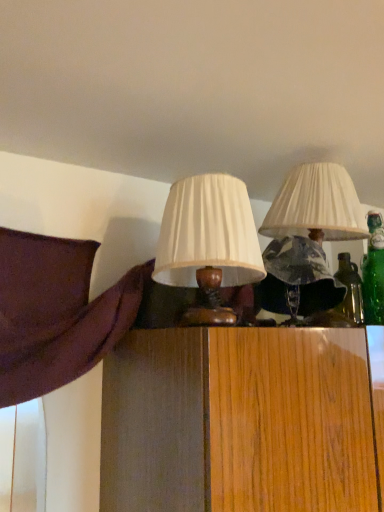
Find the location of a particular element. This screenshot has height=512, width=384. matte white lampshade at center, the second lamp positioned from the left is located at coordinates (308, 239).

Describe the element at coordinates (308, 239) in the screenshot. I see `matte white lampshade at center, which ranks as the 1th lamp in right-to-left order` at that location.

How much space does matte white lampshade at center, which ranks as the 1th lamp in right-to-left order, occupy vertically?

17.88 inches.

What is the approximate width of matte white lampshade at center, which ranks as the 1th lamp in right-to-left order?

matte white lampshade at center, which ranks as the 1th lamp in right-to-left order, is 12.69 inches in width.

The height and width of the screenshot is (512, 384). I want to click on matte white lampshade at center, the second lamp in the right-to-left sequence, so click(x=208, y=244).

The image size is (384, 512). Describe the element at coordinates (208, 244) in the screenshot. I see `matte white lampshade at center, placed as the first lamp when sorted from left to right` at that location.

Locate an element on the screen. This screenshot has width=384, height=512. matte white lampshade at center, the second lamp positioned from the left is located at coordinates (308, 239).

Considering the relative positions of matte white lampshade at center, which ranks as the 1th lamp in right-to-left order, and matte white lampshade at center, the second lamp in the right-to-left sequence, in the image provided, is matte white lampshade at center, which ranks as the 1th lamp in right-to-left order, to the left of matte white lampshade at center, the second lamp in the right-to-left sequence, from the viewer's perspective?

No.

Which object is closer to the camera, matte white lampshade at center, the second lamp positioned from the left, or matte white lampshade at center, placed as the first lamp when sorted from left to right?

matte white lampshade at center, placed as the first lamp when sorted from left to right, is in front.

Does point (304, 205) lie in front of point (198, 181)?

No, it is behind (198, 181).

From the image's perspective, is matte white lampshade at center, the second lamp positioned from the left, on matte white lampshade at center, the second lamp in the right-to-left sequence?

Yes, from the image's perspective, matte white lampshade at center, the second lamp positioned from the left, is above matte white lampshade at center, the second lamp in the right-to-left sequence.

From a real-world perspective, which is physically below, matte white lampshade at center, the second lamp positioned from the left, or matte white lampshade at center, the second lamp in the right-to-left sequence?

From a 3D spatial view, matte white lampshade at center, the second lamp in the right-to-left sequence, is below.

Considering the sizes of objects matte white lampshade at center, the second lamp positioned from the left, and matte white lampshade at center, the second lamp in the right-to-left sequence, in the image provided, who is wider, matte white lampshade at center, the second lamp positioned from the left, or matte white lampshade at center, the second lamp in the right-to-left sequence,?

matte white lampshade at center, the second lamp positioned from the left.

From their relative heights in the image, would you say matte white lampshade at center, the second lamp positioned from the left, is taller or shorter than matte white lampshade at center, placed as the first lamp when sorted from left to right?

Clearly, matte white lampshade at center, the second lamp positioned from the left, is taller compared to matte white lampshade at center, placed as the first lamp when sorted from left to right.

Is matte white lampshade at center, which ranks as the 1th lamp in right-to-left order, smaller than matte white lampshade at center, the second lamp in the right-to-left sequence?

Incorrect, matte white lampshade at center, which ranks as the 1th lamp in right-to-left order, is not smaller in size than matte white lampshade at center, the second lamp in the right-to-left sequence.

In the scene shown: Is matte white lampshade at center, which ranks as the 1th lamp in right-to-left order, not within matte white lampshade at center, placed as the first lamp when sorted from left to right?

Yes, matte white lampshade at center, which ranks as the 1th lamp in right-to-left order, is not within matte white lampshade at center, placed as the first lamp when sorted from left to right.

Is matte white lampshade at center, which ranks as the 1th lamp in right-to-left order, next to matte white lampshade at center, the second lamp in the right-to-left sequence?

No, matte white lampshade at center, which ranks as the 1th lamp in right-to-left order, is not making contact with matte white lampshade at center, the second lamp in the right-to-left sequence.

Is matte white lampshade at center, the second lamp positioned from the left, facing away from matte white lampshade at center, placed as the first lamp when sorted from left to right?

No, matte white lampshade at center, the second lamp positioned from the left, is not facing away from matte white lampshade at center, placed as the first lamp when sorted from left to right.

Can you tell me how much matte white lampshade at center, the second lamp positioned from the left, and matte white lampshade at center, the second lamp in the right-to-left sequence, differ in facing direction?

There is a 0.000387-degree angle between the facing directions of matte white lampshade at center, the second lamp positioned from the left, and matte white lampshade at center, the second lamp in the right-to-left sequence.

Where is `lamp on the left of the matte white lampshade at center, which ranks as the 1th lamp in right-to-left order`? The width and height of the screenshot is (384, 512). lamp on the left of the matte white lampshade at center, which ranks as the 1th lamp in right-to-left order is located at coordinates (208, 244).

Considering the relative positions of matte white lampshade at center, the second lamp in the right-to-left sequence, and matte white lampshade at center, which ranks as the 1th lamp in right-to-left order, in the image provided, is matte white lampshade at center, the second lamp in the right-to-left sequence, to the right of matte white lampshade at center, which ranks as the 1th lamp in right-to-left order, from the viewer's perspective?

In fact, matte white lampshade at center, the second lamp in the right-to-left sequence, is to the left of matte white lampshade at center, which ranks as the 1th lamp in right-to-left order.

Is the position of matte white lampshade at center, placed as the first lamp when sorted from left to right, more distant than that of matte white lampshade at center, the second lamp positioned from the left?

No, matte white lampshade at center, placed as the first lamp when sorted from left to right, is closer to the camera.

Between point (247, 267) and point (309, 182), which one is positioned behind?

The point (309, 182) is farther from the camera.

From the image's perspective, which object appears higher, matte white lampshade at center, the second lamp in the right-to-left sequence, or matte white lampshade at center, which ranks as the 1th lamp in right-to-left order?

matte white lampshade at center, which ranks as the 1th lamp in right-to-left order, from the image's perspective.

From a real-world perspective, is matte white lampshade at center, the second lamp in the right-to-left sequence, below matte white lampshade at center, which ranks as the 1th lamp in right-to-left order?

Yes.

Which of these two, matte white lampshade at center, placed as the first lamp when sorted from left to right, or matte white lampshade at center, the second lamp positioned from the left, is thinner?

With smaller width is matte white lampshade at center, placed as the first lamp when sorted from left to right.

Between matte white lampshade at center, the second lamp in the right-to-left sequence, and matte white lampshade at center, which ranks as the 1th lamp in right-to-left order, which one has more height?

Standing taller between the two is matte white lampshade at center, which ranks as the 1th lamp in right-to-left order.

Who is smaller, matte white lampshade at center, placed as the first lamp when sorted from left to right, or matte white lampshade at center, which ranks as the 1th lamp in right-to-left order?

matte white lampshade at center, placed as the first lamp when sorted from left to right.

Would you say matte white lampshade at center, placed as the first lamp when sorted from left to right, is inside or outside matte white lampshade at center, which ranks as the 1th lamp in right-to-left order?

matte white lampshade at center, placed as the first lamp when sorted from left to right, is spatially situated outside matte white lampshade at center, which ranks as the 1th lamp in right-to-left order.

Is matte white lampshade at center, placed as the first lamp when sorted from left to right, next to matte white lampshade at center, which ranks as the 1th lamp in right-to-left order, and touching it?

No, matte white lampshade at center, placed as the first lamp when sorted from left to right, is not making contact with matte white lampshade at center, which ranks as the 1th lamp in right-to-left order.

Does matte white lampshade at center, the second lamp in the right-to-left sequence, turn towards matte white lampshade at center, the second lamp positioned from the left?

No, matte white lampshade at center, the second lamp in the right-to-left sequence, is not aimed at matte white lampshade at center, the second lamp positioned from the left.

Could you measure the distance between matte white lampshade at center, the second lamp in the right-to-left sequence, and matte white lampshade at center, the second lamp positioned from the left?

They are 8.56 inches apart.

The height and width of the screenshot is (512, 384). What are the coordinates of `lamp on the right of matte white lampshade at center, placed as the first lamp when sorted from left to right` in the screenshot? It's located at (308, 239).

You are a GUI agent. You are given a task and a screenshot of the screen. Output one action in this format:
    pyautogui.click(x=<x>, y=<y>)
    Task: Click on the lamp located on the right of matte white lampshade at center, the second lamp in the right-to-left sequence
    This screenshot has width=384, height=512.
    Given the screenshot: What is the action you would take?
    pyautogui.click(x=308, y=239)

The width and height of the screenshot is (384, 512). What are the coordinates of `lamp located below the matte white lampshade at center, which ranks as the 1th lamp in right-to-left order (from the image's perspective)` in the screenshot? It's located at (208, 244).